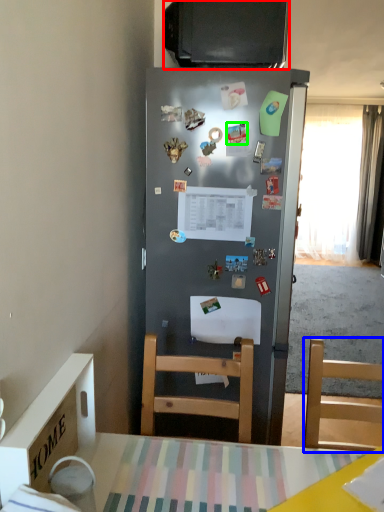
Question: Which object is the closest to the television (highlighted by a red box)? Choose among these: chair (highlighted by a blue box) or magnet (highlighted by a green box).

Choices:
 (A) chair
 (B) magnet

Answer: (B)